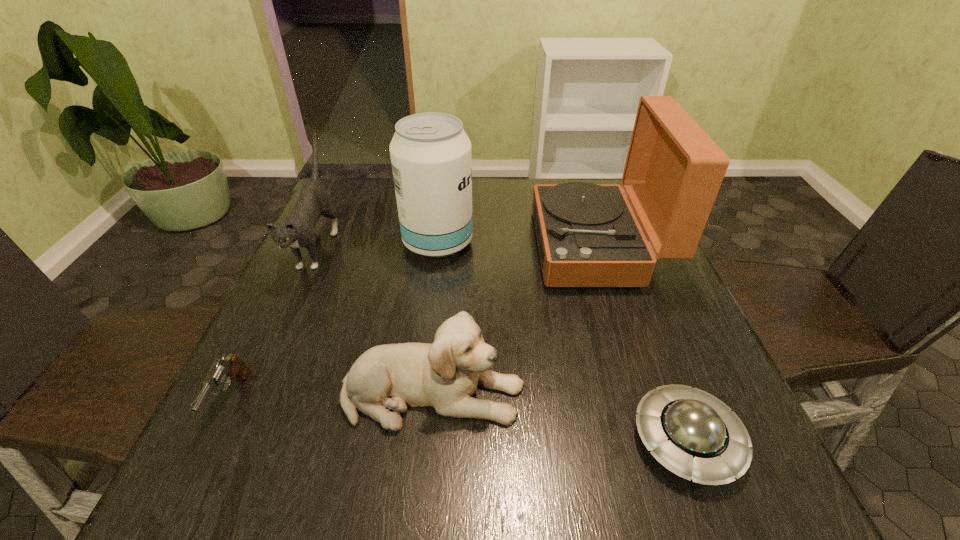
Locate an element on the screen. The width and height of the screenshot is (960, 540). saucer located at the right edge is located at coordinates (693, 434).

At what (x,y) coordinates should I click in order to perform the action: click on object at the far left corner. Please return your answer as a coordinate pair (x, y). The image size is (960, 540). Looking at the image, I should click on (297, 230).

In order to click on object situated at the far right corner in this screenshot , I will do `click(588, 236)`.

Identify the location of object that is at the near right corner. (693, 434).

Locate an element on the screen. This screenshot has width=960, height=540. free point at the far edge is located at coordinates (512, 221).

Identify the location of free space at the near edge of the desktop. This screenshot has height=540, width=960. (578, 458).

At what (x,y) coordinates should I click in order to perform the action: click on vacant space at the left edge of the desktop. Please return your answer as a coordinate pair (x, y). Looking at the image, I should click on (245, 360).

Where is `vacant space at the right edge`? Image resolution: width=960 pixels, height=540 pixels. vacant space at the right edge is located at coordinates (643, 312).

The width and height of the screenshot is (960, 540). I want to click on blank area at the far left corner, so click(x=349, y=199).

Locate an element on the screen. free space at the near left corner of the desktop is located at coordinates (212, 502).